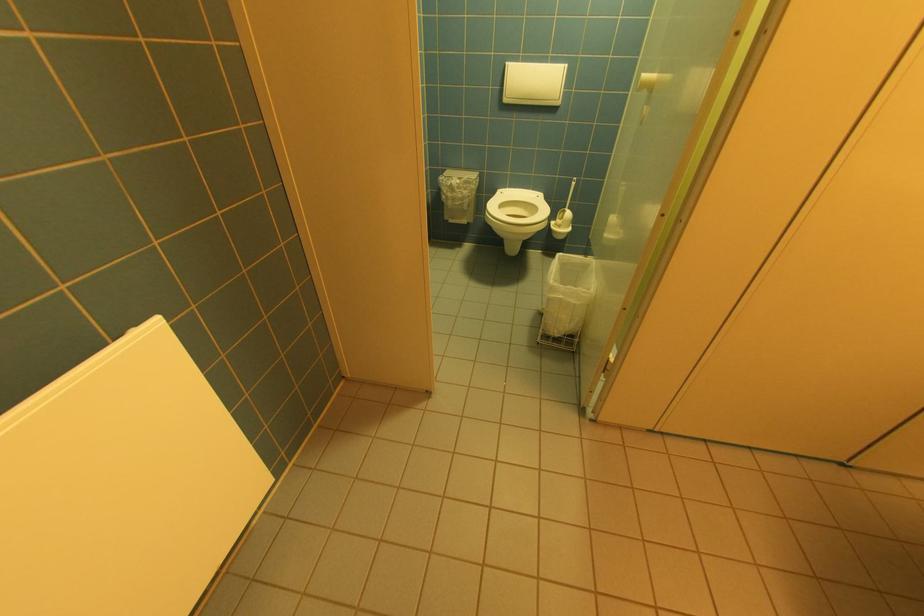
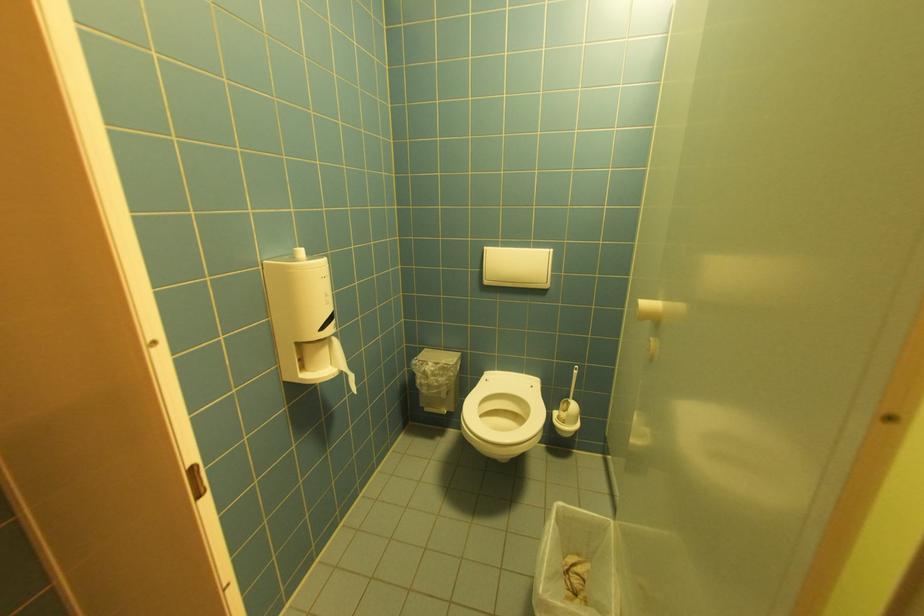
Find the pixel in the second image that matches point 568,256 in the first image.

(569, 507)